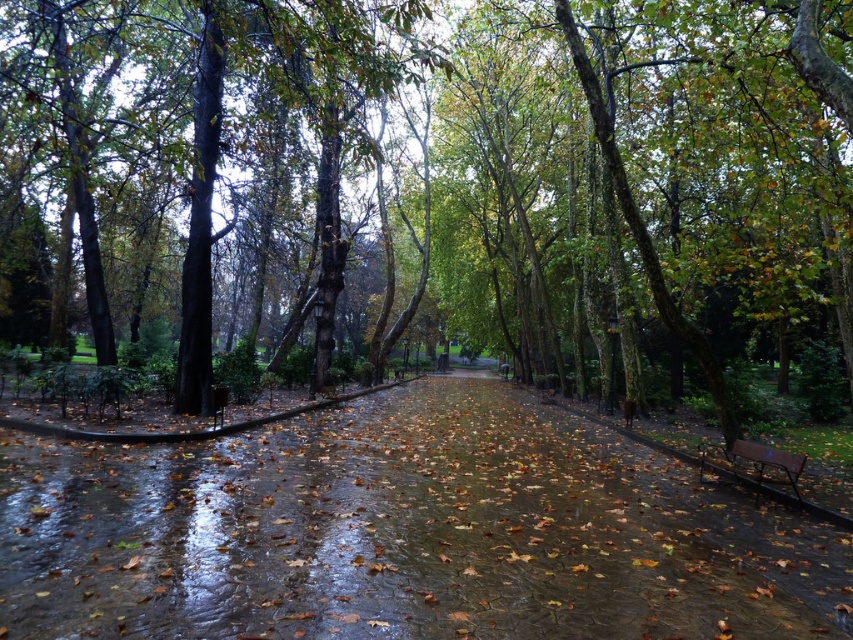
You are a park visitor standing on the path and want to sit on the brown wooden bench at lower right. Is the green leafy tree at center blocking your direct path to the bench?

The green leafy tree at center is in front of the brown wooden bench at lower right, so it is blocking the direct path to the bench.

From the picture: You are standing in the park and want to walk to the end of the wet concrete path at center. If your walking speed is 3 feet per second, how many seconds will it take you to reach the end?

The wet concrete path at center is 9.36 feet away from the viewer. At a walking speed of 3 feet per second, it will take approximately 3.12 seconds to reach the end.

You are standing on the path in the park and see two points marked in the scene. The first point is at coordinates point (144, 36) and the second point is at point (799, 452). Which point is closer to you?

Point (144, 36) is closer to you because it is further to the camera than point (799, 452).